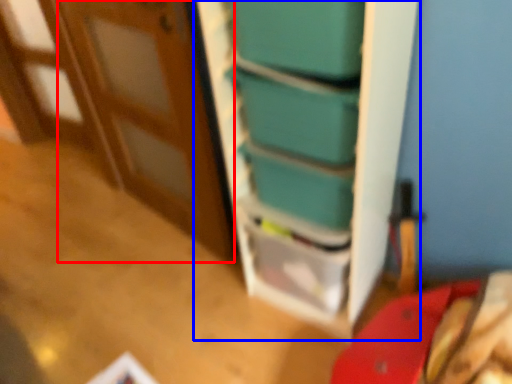
Question: Which point is further to the camera, door (highlighted by a red box) or bookshelf (highlighted by a blue box)?

Choices:
 (A) door
 (B) bookshelf

Answer: (A)